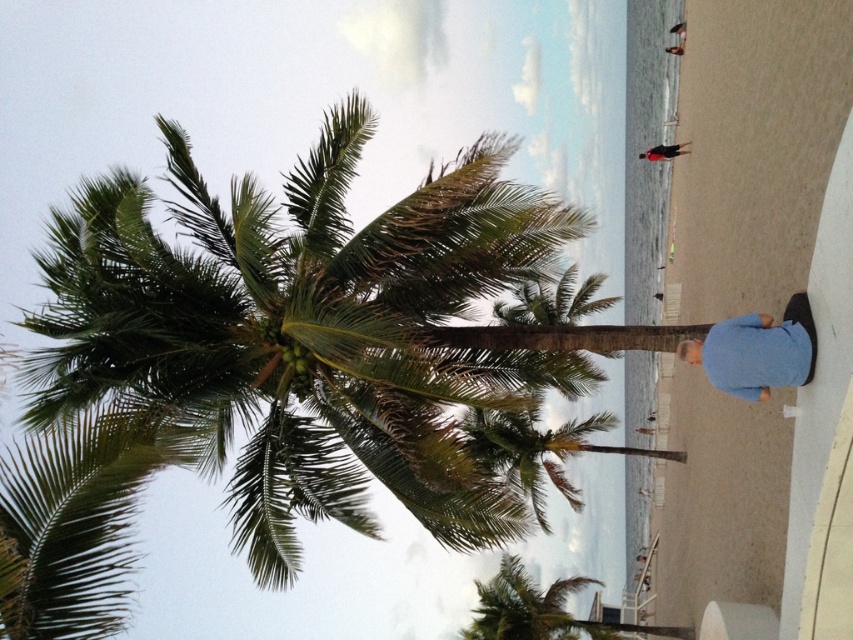
You are standing at the point labeled point (312,339) in the image. What object is located at that point?

The point (312,339) corresponds to the green leafy coconut tree at center.